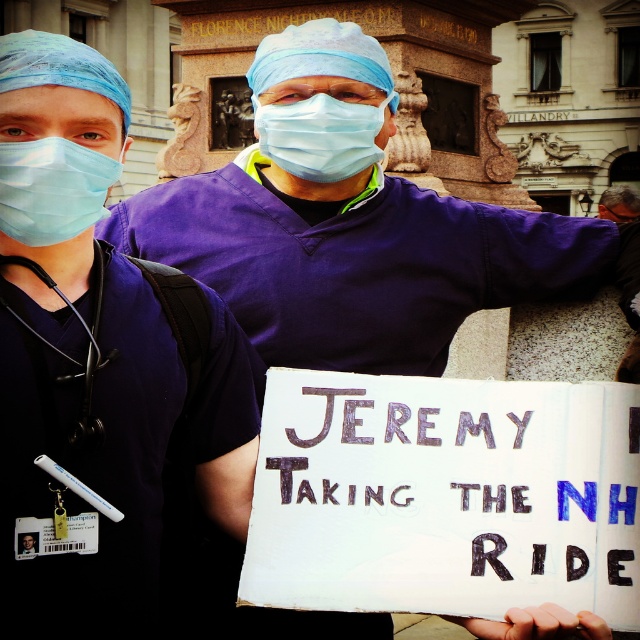
Question: Which object is farther from the camera taking this photo?

Choices:
 (A) matte blue surgical mask at left
 (B) blue fabric mask at center

Answer: (B)

Question: Which of the following is the closest to the observer?

Choices:
 (A) coord(346,150)
 (B) coord(61,227)

Answer: (B)

Question: Which point is closer to the camera?

Choices:
 (A) blue fabric mask at center
 (B) matte blue surgical mask at left

Answer: (B)

Question: Can you confirm if matte blue surgical mask at left is positioned to the left of blue fabric mask at center?

Choices:
 (A) no
 (B) yes

Answer: (B)

Question: Can you confirm if matte blue surgical mask at left is positioned above blue fabric mask at center?

Choices:
 (A) no
 (B) yes

Answer: (A)

Question: Considering the relative positions of matte blue surgical mask at left and blue fabric mask at center in the image provided, where is matte blue surgical mask at left located with respect to blue fabric mask at center?

Choices:
 (A) right
 (B) left

Answer: (B)